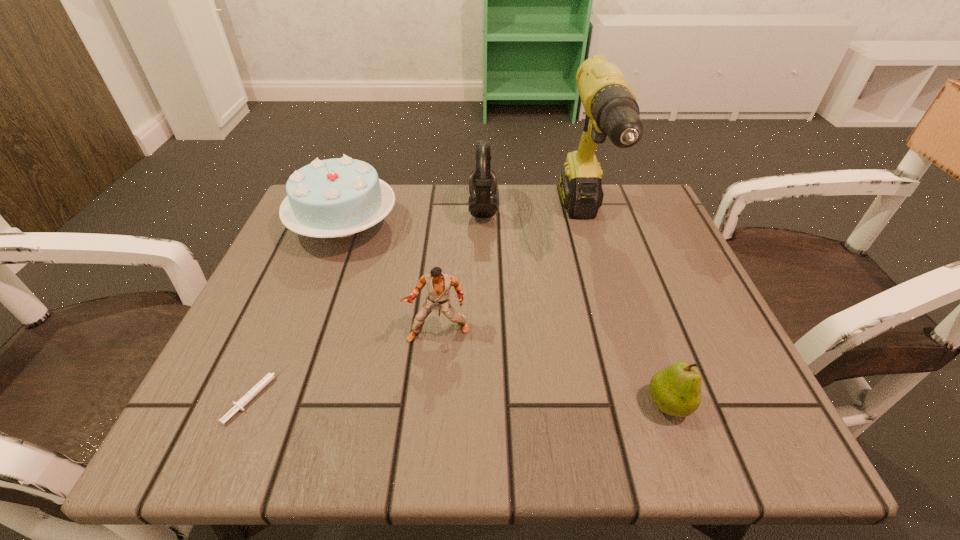
Where is `syringe at the left edge`? This screenshot has height=540, width=960. syringe at the left edge is located at coordinates (238, 405).

I want to click on drill present at the right edge, so click(x=611, y=108).

In order to click on pear located at the right edge in this screenshot , I will do `click(676, 390)`.

What are the coordinates of `object that is at the far left corner` in the screenshot? It's located at (339, 197).

What are the coordinates of `object present at the near left corner` in the screenshot? It's located at (238, 405).

You are a GUI agent. You are given a task and a screenshot of the screen. Output one action in this format:
    pyautogui.click(x=<x>, y=<y>)
    Task: Click on the object that is positioned at the far right corner
    
    Given the screenshot: What is the action you would take?
    click(x=611, y=108)

Locate an element on the screen. object that is positioned at the near right corner is located at coordinates (676, 390).

The height and width of the screenshot is (540, 960). I want to click on blank space at the far edge of the desktop, so click(x=524, y=239).

In the image, there is a desktop. Identify the location of vacant region at the near edge. This screenshot has height=540, width=960. (373, 427).

In the image, there is a desktop. Identify the location of vacant space at the left edge. (324, 252).